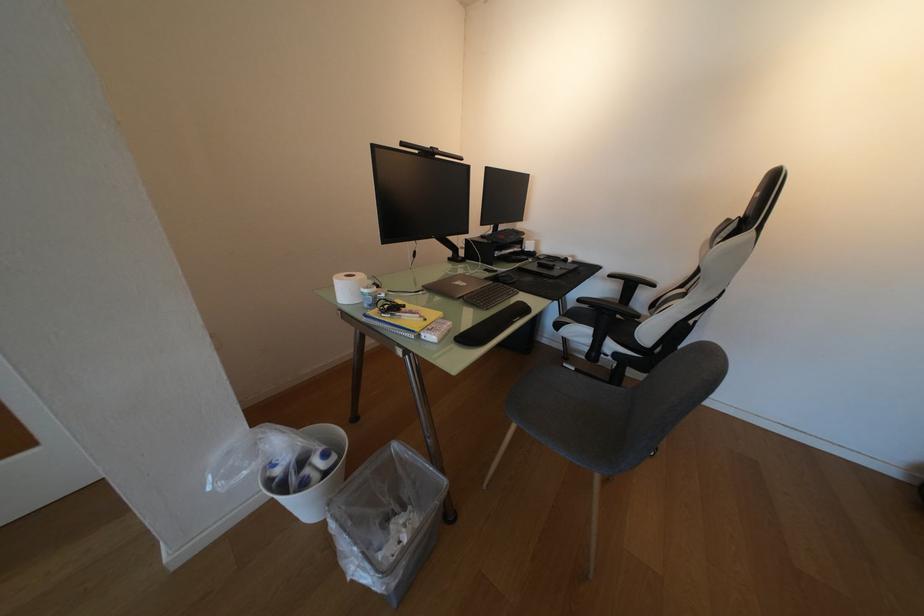
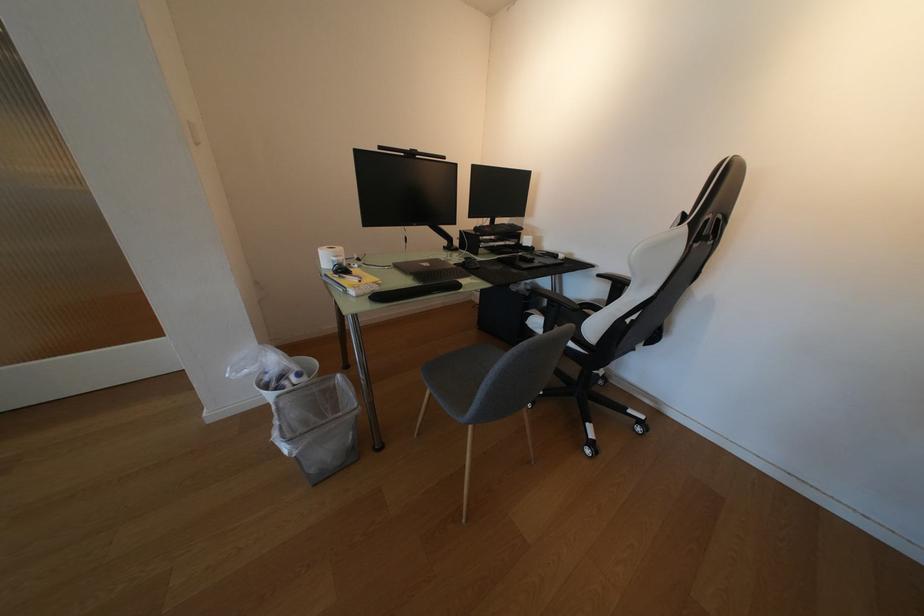
The point at (x=313, y=485) is marked in the first image. Where is the corresponding point in the second image?

(288, 390)